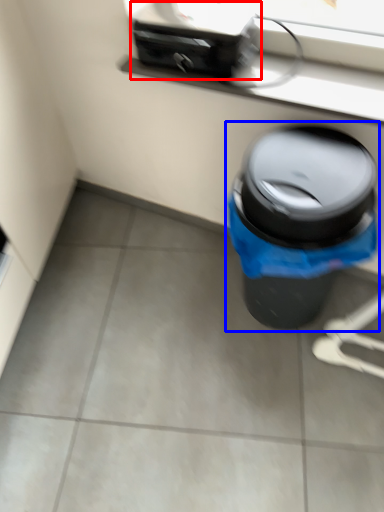
Question: Which of the following is the closest to the observer, appliance (highlighted by a red box) or waste container (highlighted by a blue box)?

Choices:
 (A) appliance
 (B) waste container

Answer: (B)